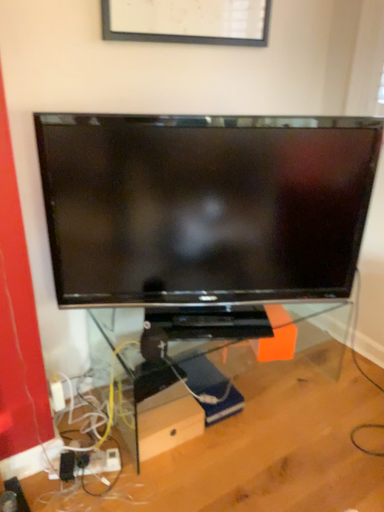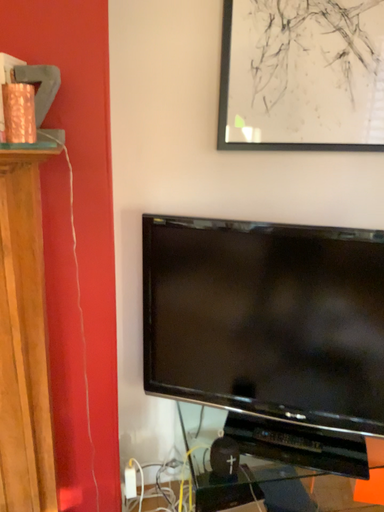
Question: How did the camera likely rotate when shooting the video?

Choices:
 (A) rotated downward
 (B) rotated upward

Answer: (B)